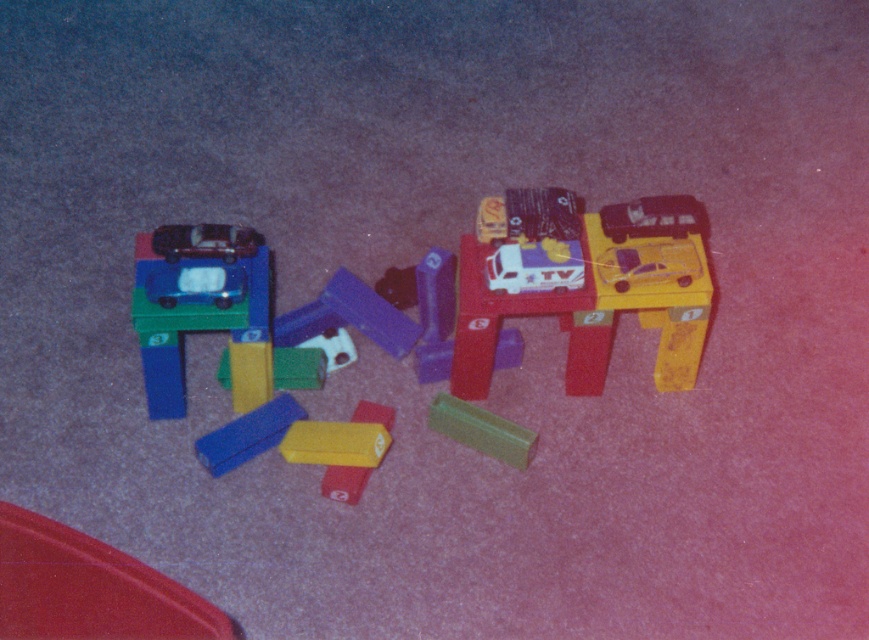
You are a child trying to reach the green matte block at center from where you are standing next to the matte plastic toy car at upper left. Can you grab it without moving your feet?

The distance between the matte plastic toy car at upper left and the green matte block at center is 9.11 inches, so you can easily reach it without moving your feet since 9.11 inches is within a comfortable arm reach.

You are a child who wants to reach the matte plastic car at left from where you are standing. The distance between you and the car is 1.46 meters. If you can jump 1.5 meters, will you be able to reach it?

The distance between you and the matte plastic car at left is 1.46 meters, so yes, you can reach it since your jump can cover 1.5 meters which is slightly longer than the required distance.

You are a child trying to reach the matte black car at left but there is a blue matte block at lower center in the way. Can you move the block to access the car?

The matte black car at left is behind the blue matte block at lower center, so moving the blue matte block at lower center would allow access to the matte black car at left.